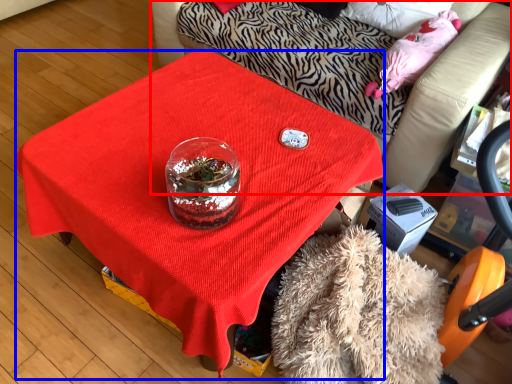
Question: Among these objects, which one is farthest to the camera, furniture (highlighted by a red box) or desk (highlighted by a blue box)?

Choices:
 (A) furniture
 (B) desk

Answer: (A)